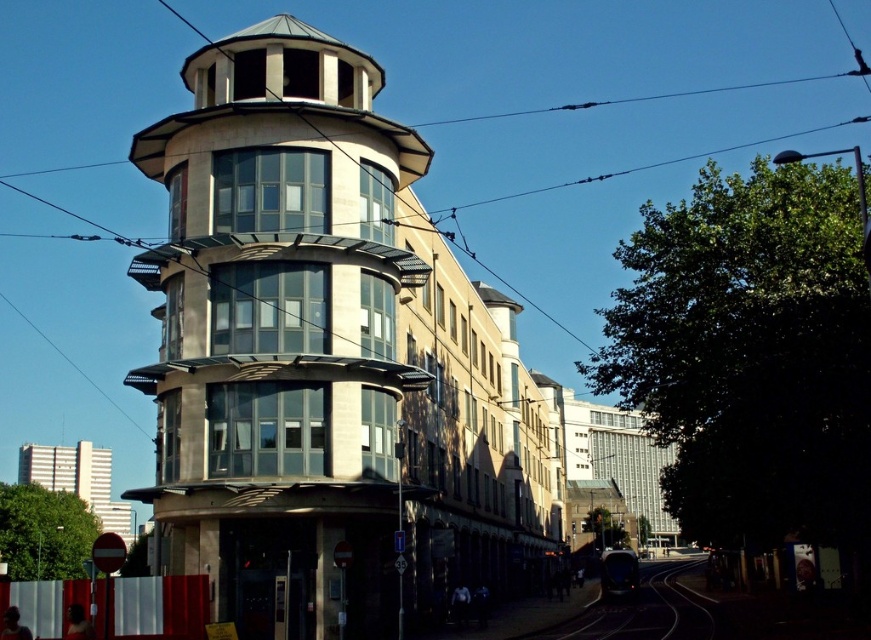
Question: Among these objects, which one is nearest to the camera?

Choices:
 (A) black asphalt train track at lower center
 (B) matte glass bell tower at center

Answer: (B)

Question: Which point appears farthest from the camera in this image?

Choices:
 (A) (171, 320)
 (B) (618, 627)

Answer: (B)

Question: Does matte glass bell tower at center come behind black asphalt train track at lower center?

Choices:
 (A) no
 (B) yes

Answer: (A)

Question: Is the position of matte glass bell tower at center more distant than that of black asphalt train track at lower center?

Choices:
 (A) yes
 (B) no

Answer: (B)

Question: Considering the relative positions of matte glass bell tower at center and black asphalt train track at lower center in the image provided, where is matte glass bell tower at center located with respect to black asphalt train track at lower center?

Choices:
 (A) below
 (B) above

Answer: (B)